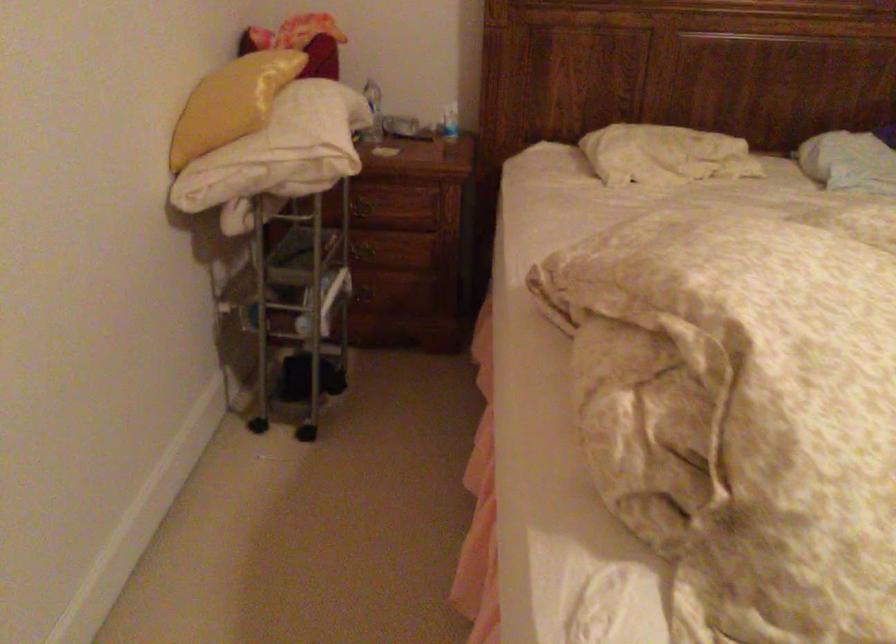
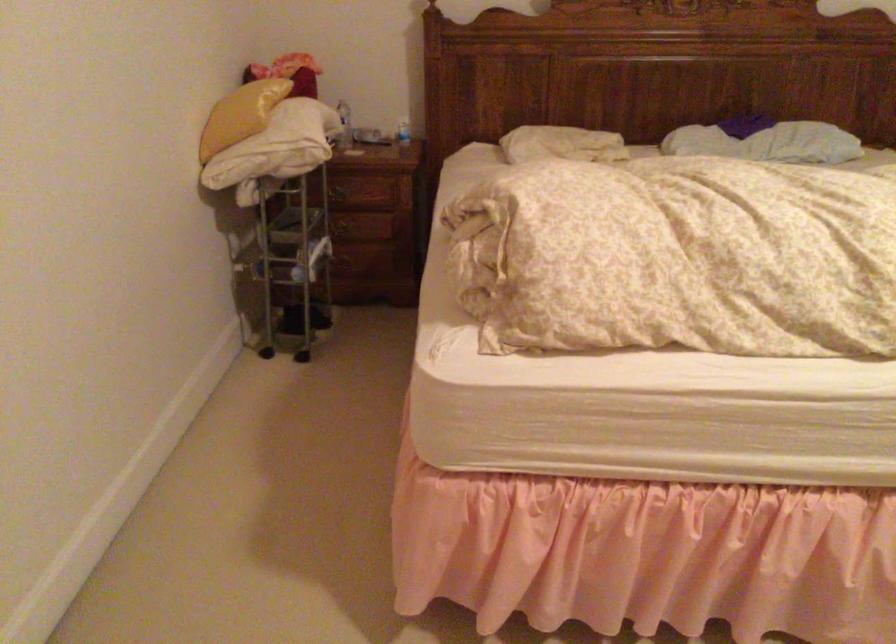
The point at (358, 212) is marked in the first image. Where is the corresponding point in the second image?

(338, 194)